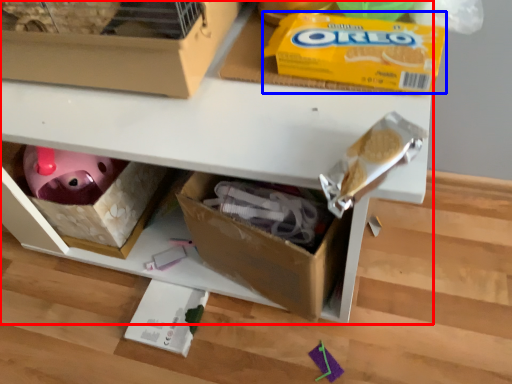
Question: Which point is further to the camera, shelf (highlighted by a red box) or cereal (highlighted by a blue box)?

Choices:
 (A) shelf
 (B) cereal

Answer: (B)